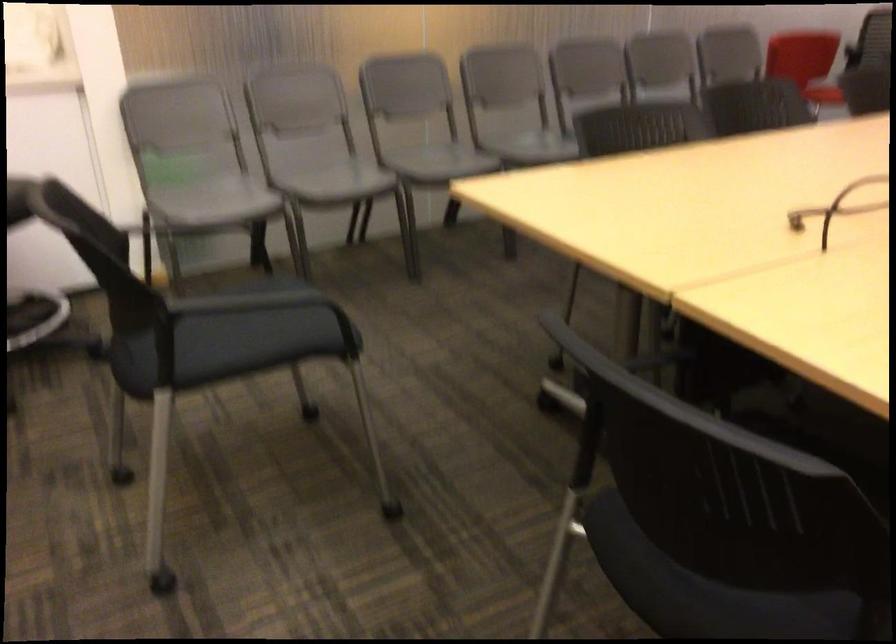
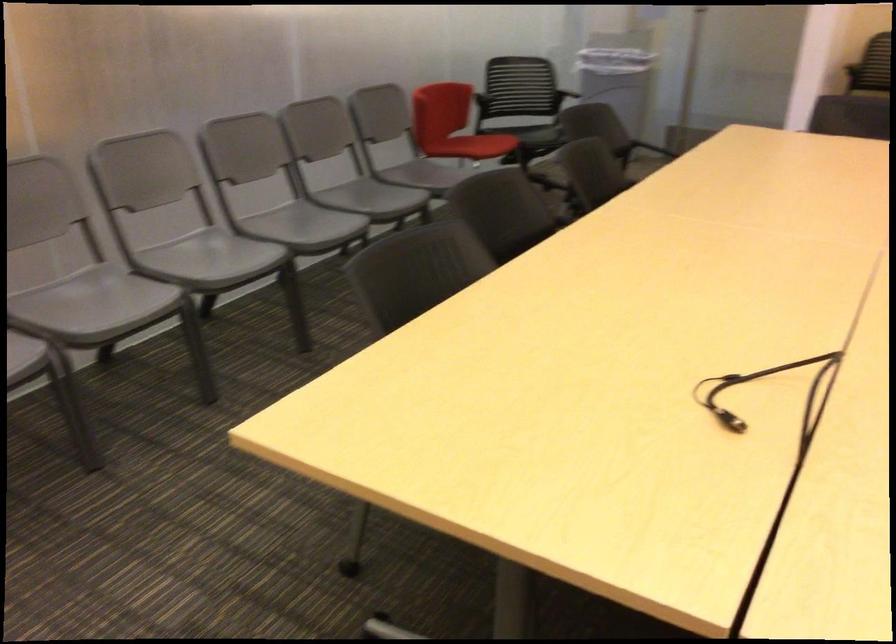
Question: The camera is either moving clockwise (left) or counter-clockwise (right) around the object. The first image is from the beginning of the video and the second image is from the end. Is the camera moving left or right when shooting the video?

Choices:
 (A) Left
 (B) Right

Answer: (A)